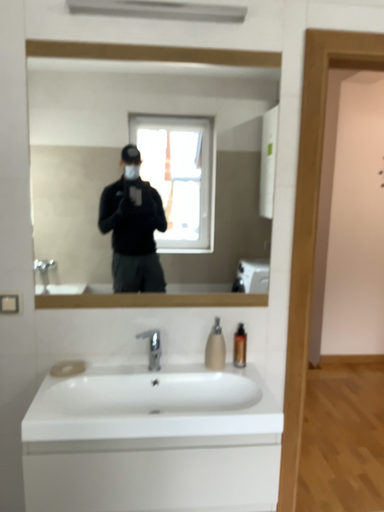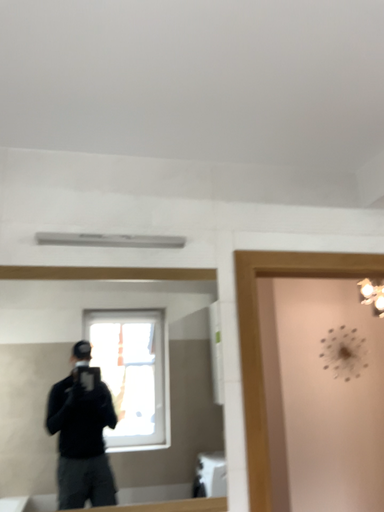
Question: Which way did the camera rotate in the video?

Choices:
 (A) rotated downward
 (B) rotated upward

Answer: (B)